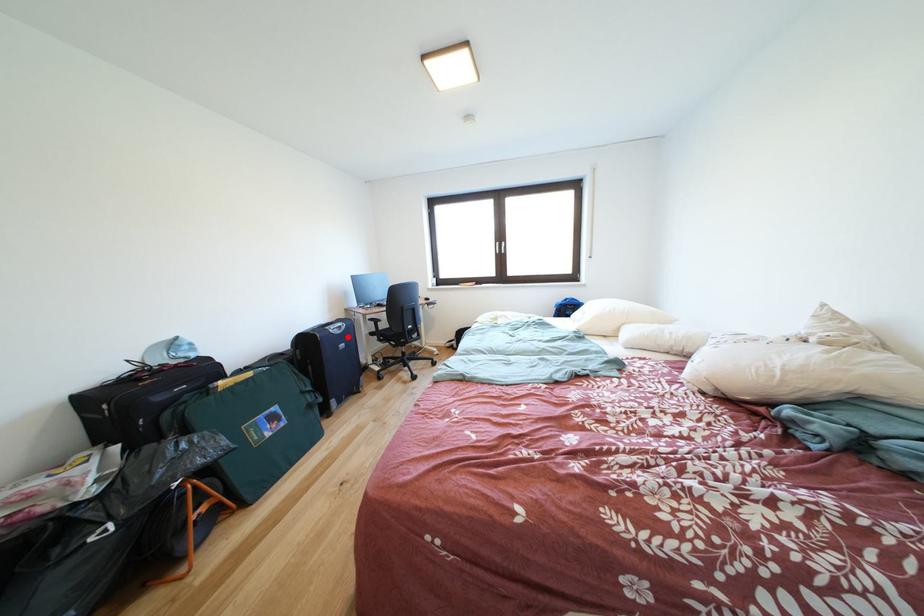
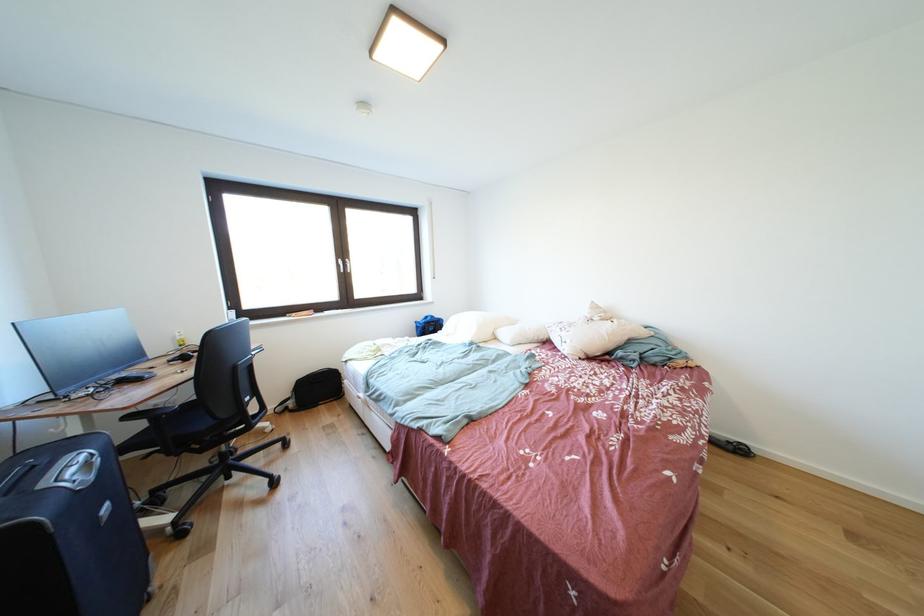
Find the pixel in the second image that matches the highlighted location in the first image.

(101, 483)